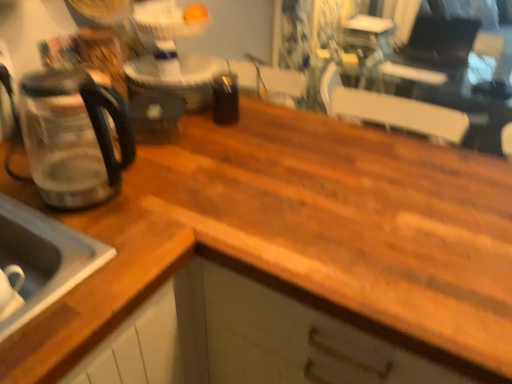
Measure the distance between satin silver sink at lower left and camera.

satin silver sink at lower left and camera are 55.71 centimeters apart from each other.

Where is `satin silver sink at lower left`? satin silver sink at lower left is located at coordinates (44, 258).

Describe the element at coordinates (44, 258) in the screenshot. I see `satin silver sink at lower left` at that location.

In order to face transparent glass coffeepot at left, should I rotate leftwards or rightwards?

It's best to rotate left around 21.881 degrees.

What do you see at coordinates (74, 137) in the screenshot?
I see `transparent glass coffeepot at left` at bounding box center [74, 137].

Identify the location of transparent glass coffeepot at left. This screenshot has width=512, height=384. (74, 137).

Locate an element on the screen. Image resolution: width=512 pixels, height=384 pixels. satin silver sink at lower left is located at coordinates (44, 258).

Based on their positions, is transparent glass coffeepot at left located to the left or right of satin silver sink at lower left?

transparent glass coffeepot at left is to the right of satin silver sink at lower left.

Based on the photo, considering the positions of objects transparent glass coffeepot at left and satin silver sink at lower left in the image provided, who is behind, transparent glass coffeepot at left or satin silver sink at lower left?

transparent glass coffeepot at left is further away from the camera.

Which point is more distant from viewer, [59,183] or [38,233]?

The point [59,183] is more distant.

From the image's perspective, is transparent glass coffeepot at left below satin silver sink at lower left?

No, from the image's perspective, transparent glass coffeepot at left is not below satin silver sink at lower left.

From a real-world perspective, is transparent glass coffeepot at left on satin silver sink at lower left?

Correct, in the physical world, transparent glass coffeepot at left is higher than satin silver sink at lower left.

Looking at this image, considering the sizes of objects transparent glass coffeepot at left and satin silver sink at lower left in the image provided, who is wider, transparent glass coffeepot at left or satin silver sink at lower left?

Wider between the two is satin silver sink at lower left.

Considering the sizes of transparent glass coffeepot at left and satin silver sink at lower left in the image, is transparent glass coffeepot at left taller or shorter than satin silver sink at lower left?

In the image, transparent glass coffeepot at left appears to be taller than satin silver sink at lower left.

Who is smaller, transparent glass coffeepot at left or satin silver sink at lower left?

With smaller size is transparent glass coffeepot at left.

Is transparent glass coffeepot at left not within satin silver sink at lower left?

Yes, transparent glass coffeepot at left is not within satin silver sink at lower left.

Is transparent glass coffeepot at left not close to satin silver sink at lower left?

No, transparent glass coffeepot at left is not far from satin silver sink at lower left.

Is transparent glass coffeepot at left looking in the opposite direction of satin silver sink at lower left?

No, transparent glass coffeepot at left is not facing the opposite direction of satin silver sink at lower left.

How different are the orientations of transparent glass coffeepot at left and satin silver sink at lower left in degrees?

The facing directions of transparent glass coffeepot at left and satin silver sink at lower left are 0.941 degrees apart.

How much distance is there between transparent glass coffeepot at left and satin silver sink at lower left?

They are 6.60 inches apart.

The image size is (512, 384). Find the location of `sink located underneath the transparent glass coffeepot at left (from a real-world perspective)`. sink located underneath the transparent glass coffeepot at left (from a real-world perspective) is located at coordinates (44, 258).

Considering the relative positions of satin silver sink at lower left and transparent glass coffeepot at left in the image provided, is satin silver sink at lower left to the right of transparent glass coffeepot at left from the viewer's perspective?

No.

Is satin silver sink at lower left in front of or behind transparent glass coffeepot at left in the image?

In the image, satin silver sink at lower left appears in front of transparent glass coffeepot at left.

Between point (25, 267) and point (33, 158), which one is positioned in front?

The point (25, 267) is closer to the camera.

From the image's perspective, would you say satin silver sink at lower left is shown under transparent glass coffeepot at left?

Yes, from the image's perspective, satin silver sink at lower left is below transparent glass coffeepot at left.

From a real-world perspective, is satin silver sink at lower left below transparent glass coffeepot at left?

Yes, from a real-world perspective, satin silver sink at lower left is beneath transparent glass coffeepot at left.

Is satin silver sink at lower left wider or thinner than transparent glass coffeepot at left?

satin silver sink at lower left is wider than transparent glass coffeepot at left.

In terms of height, does satin silver sink at lower left look taller or shorter compared to transparent glass coffeepot at left?

satin silver sink at lower left is shorter than transparent glass coffeepot at left.

Considering the relative sizes of satin silver sink at lower left and transparent glass coffeepot at left in the image provided, is satin silver sink at lower left smaller than transparent glass coffeepot at left?

Incorrect, satin silver sink at lower left is not smaller in size than transparent glass coffeepot at left.

Is transparent glass coffeepot at left inside satin silver sink at lower left?

Definitely not — transparent glass coffeepot at left is not inside satin silver sink at lower left.

Are satin silver sink at lower left and transparent glass coffeepot at left making contact?

No, satin silver sink at lower left is not with transparent glass coffeepot at left.

Could you tell me if satin silver sink at lower left is facing transparent glass coffeepot at left?

No.

How much distance is there between satin silver sink at lower left and transparent glass coffeepot at left?

The distance of satin silver sink at lower left from transparent glass coffeepot at left is 6.60 inches.

Identify the location of sink that appears in front of the transparent glass coffeepot at left. The image size is (512, 384). (44, 258).

You are a GUI agent. You are given a task and a screenshot of the screen. Output one action in this format:
    pyautogui.click(x=<x>, y=<y>)
    Task: Click on the coffeepot that is on the right side of satin silver sink at lower left
    This screenshot has height=384, width=512.
    Given the screenshot: What is the action you would take?
    pyautogui.click(x=74, y=137)

Locate an element on the screen. The height and width of the screenshot is (384, 512). coffeepot above the satin silver sink at lower left (from a real-world perspective) is located at coordinates tap(74, 137).